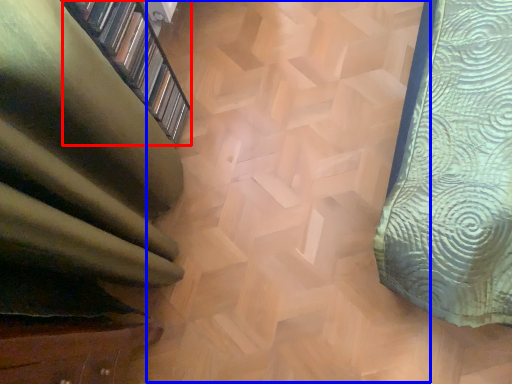
Question: Which object appears closest to the camera in this image, shelf (highlighted by a red box) or stairwell (highlighted by a blue box)?

Choices:
 (A) shelf
 (B) stairwell

Answer: (A)